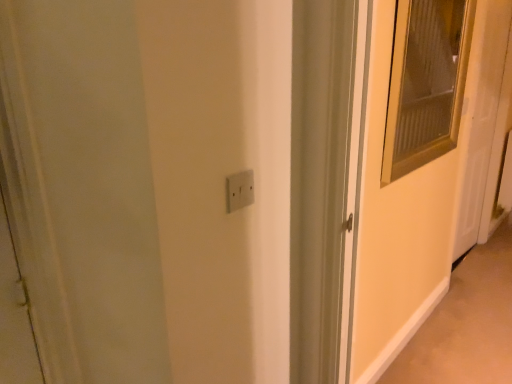
Question: Considering the positions of matte glass screen door at right and beige carpet at lower right in the image, is matte glass screen door at right bigger or smaller than beige carpet at lower right?

Choices:
 (A) big
 (B) small

Answer: (B)

Question: Looking at their shapes, would you say matte glass screen door at right is wider or thinner than beige carpet at lower right?

Choices:
 (A) thin
 (B) wide

Answer: (A)

Question: Which object is the farthest from the beige carpet at lower right?

Choices:
 (A) white plastic electric outlet at center
 (B) white glossy door at right
 (C) matte glass screen door at right

Answer: (A)

Question: Which is nearer to the beige carpet at lower right?

Choices:
 (A) matte glass screen door at right
 (B) white plastic electric outlet at center
 (C) white glossy door at right

Answer: (A)